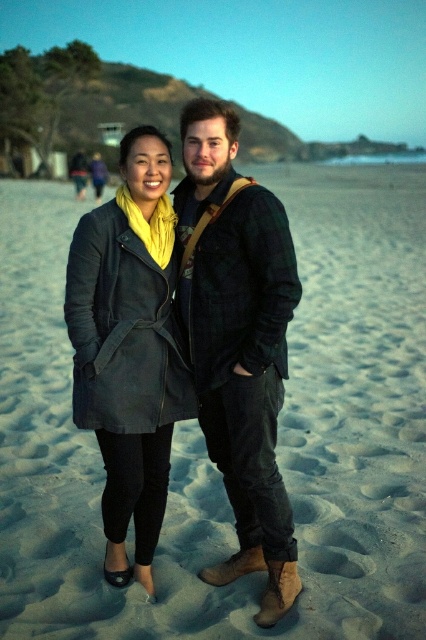
Question: Observing the image, what is the correct spatial positioning of sandy beach at center in reference to matte black coat at center?

Choices:
 (A) below
 (B) above

Answer: (B)

Question: Which object is farther from the camera taking this photo?

Choices:
 (A) matte black coat at center
 (B) sandy beach at center
 (C) flannel shirt at center

Answer: (A)

Question: Which of the following is the closest to the observer?

Choices:
 (A) sandy beach at center
 (B) flannel shirt at center
 (C) matte black coat at center

Answer: (A)

Question: Which point is farther from the camera taking this photo?

Choices:
 (A) (152, 230)
 (B) (316, 464)
 (C) (258, 250)

Answer: (B)

Question: Does flannel shirt at center appear over matte black coat at center?

Choices:
 (A) no
 (B) yes

Answer: (B)

Question: Observing the image, what is the correct spatial positioning of sandy beach at center in reference to matte black coat at center?

Choices:
 (A) below
 (B) above

Answer: (B)